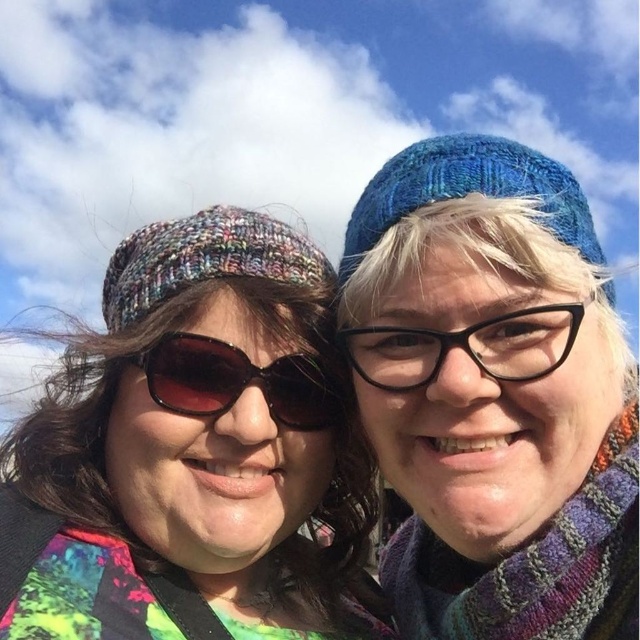
Does point (61, 467) lie behind point (474, 148)?

That is True.

Who is positioned more to the left, multicolored knit hat at left or blue knitted hat at upper right?

multicolored knit hat at left is more to the left.

What do you see at coordinates (193, 451) in the screenshot? The height and width of the screenshot is (640, 640). I see `multicolored knit hat at left` at bounding box center [193, 451].

Where is `multicolored knit hat at left`? The width and height of the screenshot is (640, 640). multicolored knit hat at left is located at coordinates (193, 451).

Can you confirm if blue knitted hat at upper center is thinner than blue knitted hat at upper right?

Yes.

Describe the element at coordinates (493, 394) in the screenshot. This screenshot has height=640, width=640. I see `blue knitted hat at upper center` at that location.

At what (x,y) coordinates should I click in order to perform the action: click on blue knitted hat at upper center. Please return your answer as a coordinate pair (x, y). The image size is (640, 640). Looking at the image, I should click on (493, 394).

Does multicolored knit hat at left appear under black plastic glasses at center?

Indeed, multicolored knit hat at left is positioned under black plastic glasses at center.

Which of these two, multicolored knit hat at left or black plastic glasses at center, stands shorter?

black plastic glasses at center

In order to click on multicolored knit hat at left in this screenshot , I will do `click(193, 451)`.